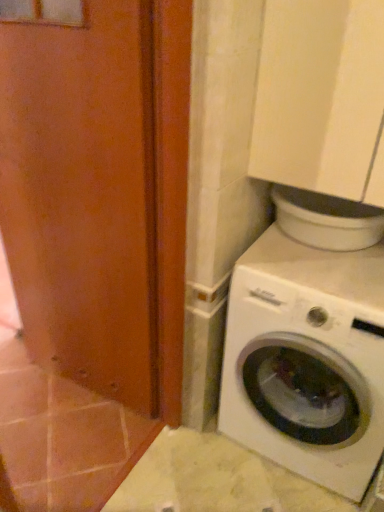
Image resolution: width=384 pixels, height=512 pixels. In order to click on free space above white matte washing machine at lower right (from a real-world perspective) in this screenshot , I will do `click(324, 265)`.